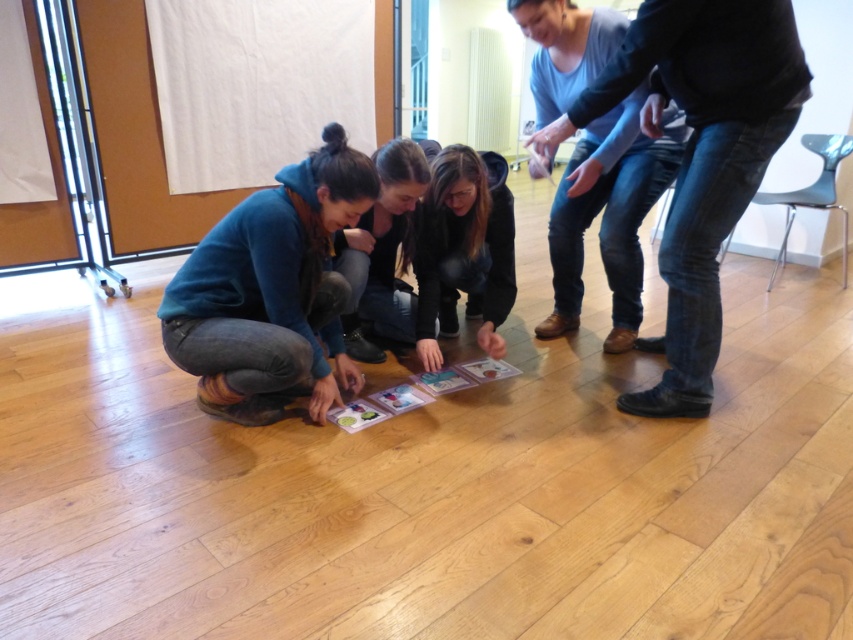
You are a photographer trying to capture a closeup of the translucent plastic cards at center without including the matte black hoodie at center in the frame. Is this possible given their sizes?

The matte black hoodie at center is larger in size than the translucent plastic cards at center, so it might block the view. Adjust your angle or position to ensure the hoodie is out of frame while focusing on the cards.

You are a person standing at the edge of the room and want to reach the translucent plastic cards at center without touching the matte black hoodie at center. Is there enough space between them for you to move through?

The distance between the matte black hoodie at center and the translucent plastic cards at center is 14.81 inches. Since you need to move through without touching, the space is sufficient as 14.81 inches allows for safe passage.

You are standing in the room and notice two items at the center of the scene. Which item is larger in size between the jeans at center and the black fabric jacket at center?

The jeans at center is bigger than the black fabric jacket at center according to the description.